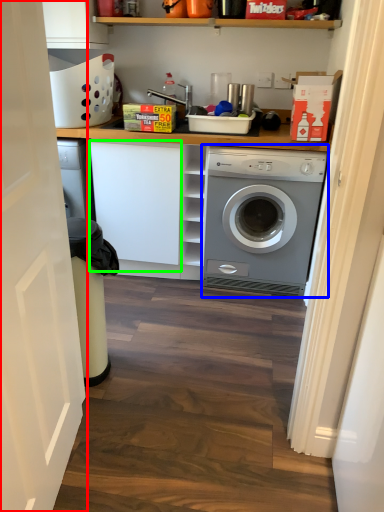
Question: Which object is the farthest from door (highlighted by a red box)? Choose among these: washing machine (highlighted by a blue box) or cabinetry (highlighted by a green box).

Choices:
 (A) washing machine
 (B) cabinetry

Answer: (A)